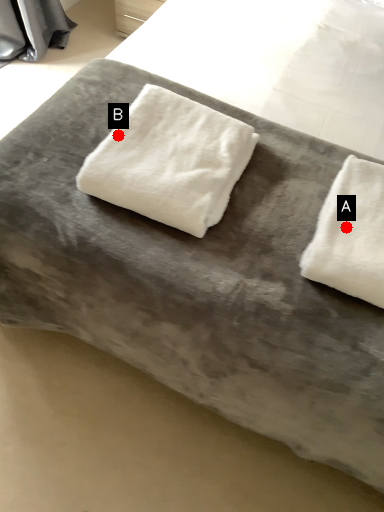
Question: Two points are circled on the image, labeled by A and B beside each circle. Among these points, which one is farthest from the camera?

Choices:
 (A) A is further
 (B) B is further

Answer: (B)